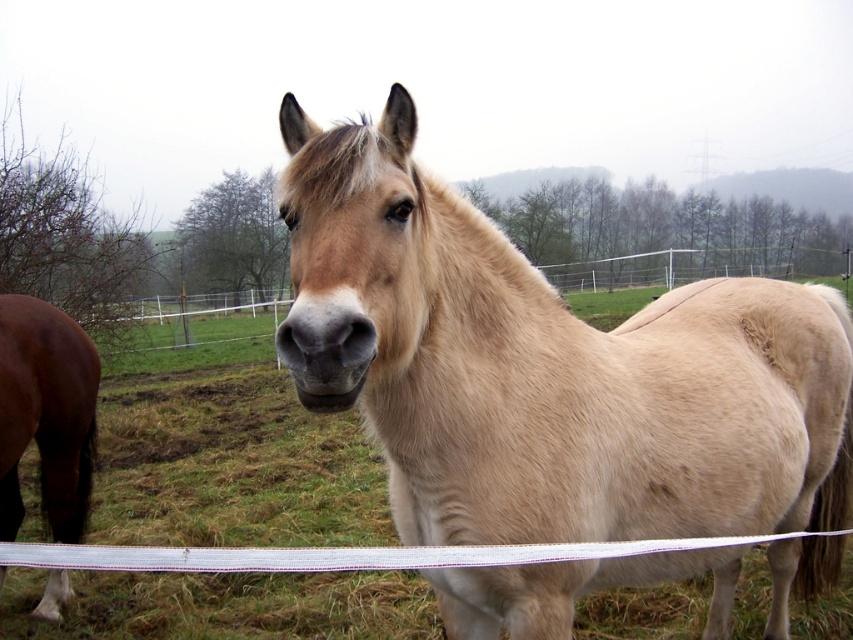
Question: Is light brown horse at center to the left of brown glossy horse at left from the viewer's perspective?

Choices:
 (A) yes
 (B) no

Answer: (B)

Question: Is light brown horse at center smaller than brown glossy horse at left?

Choices:
 (A) yes
 (B) no

Answer: (B)

Question: Which object is closer to the camera taking this photo?

Choices:
 (A) light brown horse at center
 (B) brown glossy horse at left

Answer: (A)

Question: Which point appears farthest from the camera in this image?

Choices:
 (A) (483, 422)
 (B) (91, 448)

Answer: (B)

Question: Is light brown horse at center smaller than brown glossy horse at left?

Choices:
 (A) yes
 (B) no

Answer: (B)

Question: Which object appears closest to the camera in this image?

Choices:
 (A) brown glossy horse at left
 (B) light brown horse at center

Answer: (B)